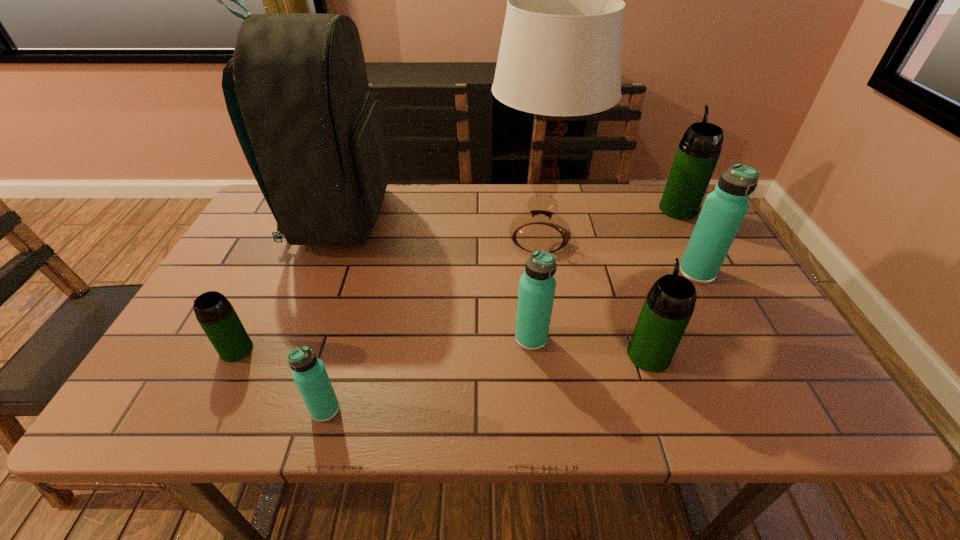
Locate an element on the screen. thermos bottle that is the sixth closest one to the gray backpack is located at coordinates (698, 152).

At what (x,y) coordinates should I click in order to perform the action: click on green thermos bottle identified as the closest to the farthest green thermos bottle. Please return your answer as a coordinate pair (x, y). Looking at the image, I should click on (669, 305).

Point out which green thermos bottle is positioned as the nearest to the farthest thermos bottle. Please provide its 2D coordinates. Your answer should be formatted as a tuple, i.e. [(x, y)], where the tuple contains the x and y coordinates of a point satisfying the conditions above.

[(669, 305)]

Where is `the second closest aqua thermos bottle to the biggest green thermos bottle`? This screenshot has width=960, height=540. the second closest aqua thermos bottle to the biggest green thermos bottle is located at coordinates (537, 285).

The image size is (960, 540). What are the coordinates of `aqua thermos bottle that stands as the second closest to the smallest green thermos bottle` in the screenshot? It's located at (537, 285).

This screenshot has width=960, height=540. Find the location of `free space that satisfies the following two spatial constraints: 1. on the back side of the leftmost aqua thermos bottle; 2. on the front-facing side of the backpack`. free space that satisfies the following two spatial constraints: 1. on the back side of the leftmost aqua thermos bottle; 2. on the front-facing side of the backpack is located at coordinates (379, 219).

This screenshot has height=540, width=960. Find the location of `free spot that satisfies the following two spatial constraints: 1. from the spout of the second thermos bottle from left to right; 2. on the left side of the smallest green thermos bottle`. free spot that satisfies the following two spatial constraints: 1. from the spout of the second thermos bottle from left to right; 2. on the left side of the smallest green thermos bottle is located at coordinates (206, 410).

Identify the location of free space that satisfies the following two spatial constraints: 1. on the front-facing side of the gray backpack; 2. on the left side of the biggest aqua thermos bottle. The height and width of the screenshot is (540, 960). (319, 272).